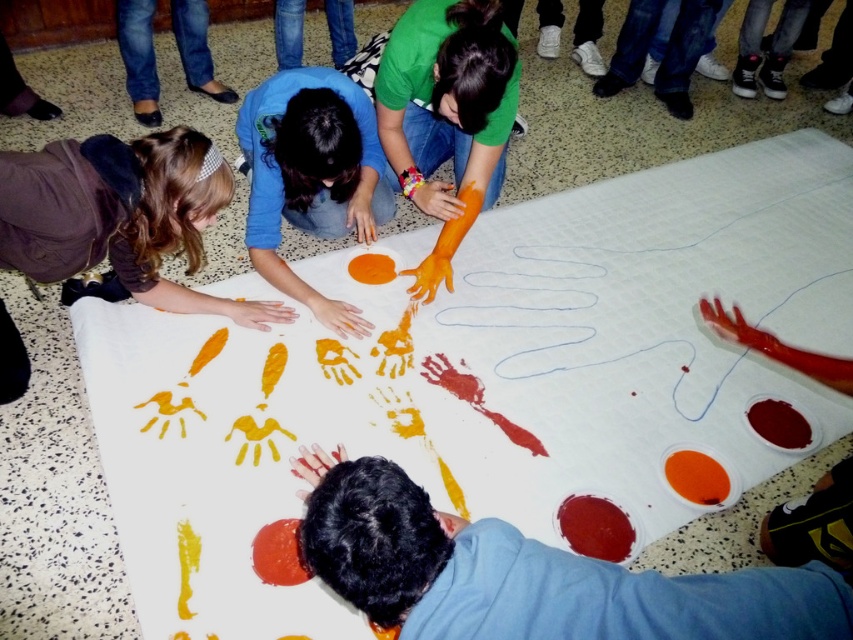
Which is more to the left, brown fuzzy jacket at lower left or matte orange handprint at center?

From the viewer's perspective, brown fuzzy jacket at lower left appears more on the left side.

Between point (234, 316) and point (236, 132), which one is positioned in front?

Point (234, 316) is more forward.

Identify the location of brown fuzzy jacket at lower left. (119, 216).